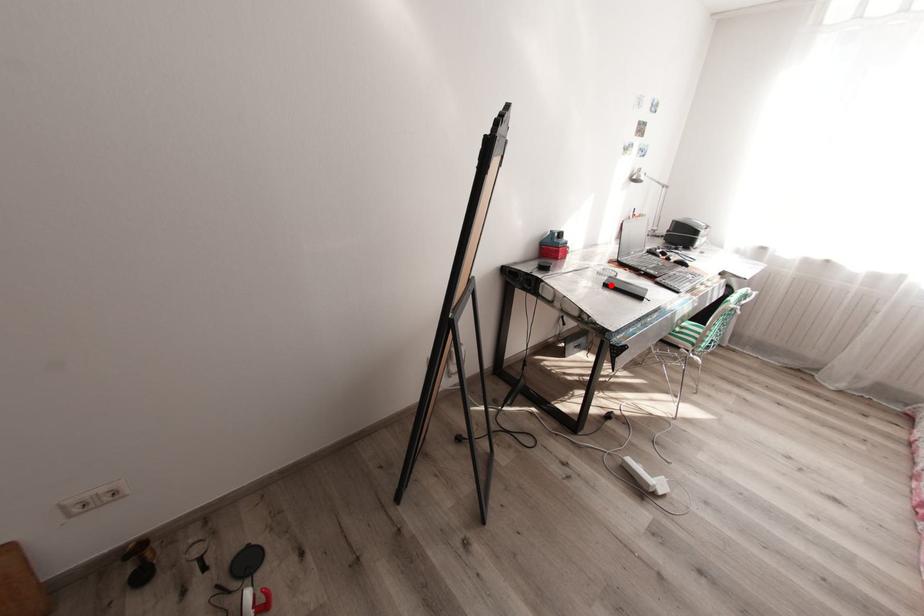
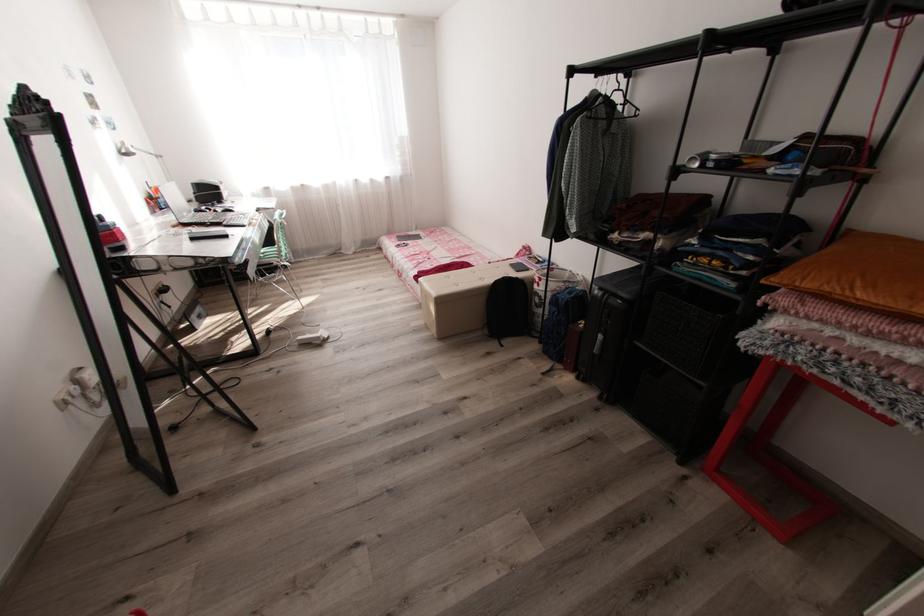
Locate, in the second image, the point that corresponds to the highlighted location in the first image.

(198, 238)